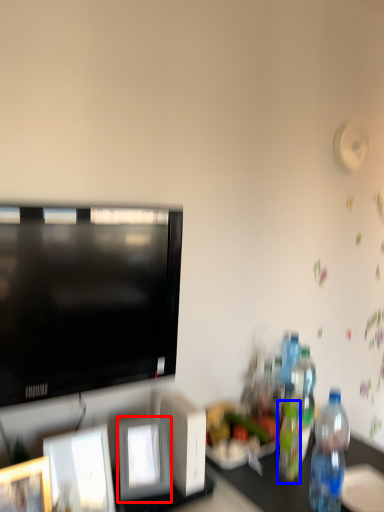
Question: Which object appears farthest to the camera in this image, picture frame (highlighted by a red box) or bottle (highlighted by a blue box)?

Choices:
 (A) picture frame
 (B) bottle

Answer: (B)